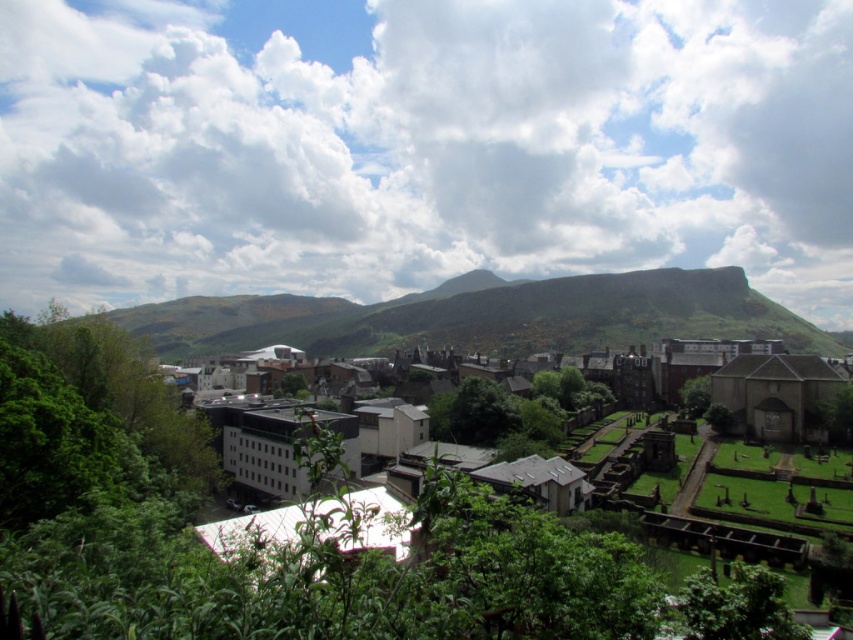
You are standing in the town square and looking at the sky. There is a point marked at coordinates [421,145]. What object is located at that point?

The point at coordinates [421,145] corresponds to a white fluffy cloud at upper center.

You are an astronomer observing the sky from the town. You notice the white fluffy cloud at upper center. Can you determine its exact position in the image using coordinates?

The white fluffy cloud at upper center is located at point (421,145).